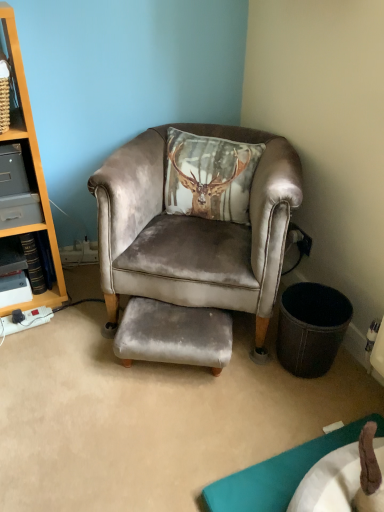
Question: From their relative heights in the image, would you say gray plastic drawer at left is taller or shorter than velvet grey chair at center?

Choices:
 (A) tall
 (B) short

Answer: (B)

Question: Does point (9, 180) appear closer or farther from the camera than point (130, 207)?

Choices:
 (A) farther
 (B) closer

Answer: (B)

Question: Which object is positioned closest to the velvet grey footrest at center?

Choices:
 (A) gray plastic drawer at left
 (B) velvet grey chair at center

Answer: (B)

Question: Estimate the real-world distances between objects in this image. Which object is closer to the velvet grey chair at center?

Choices:
 (A) gray plastic drawer at left
 (B) velvet grey footrest at center

Answer: (B)